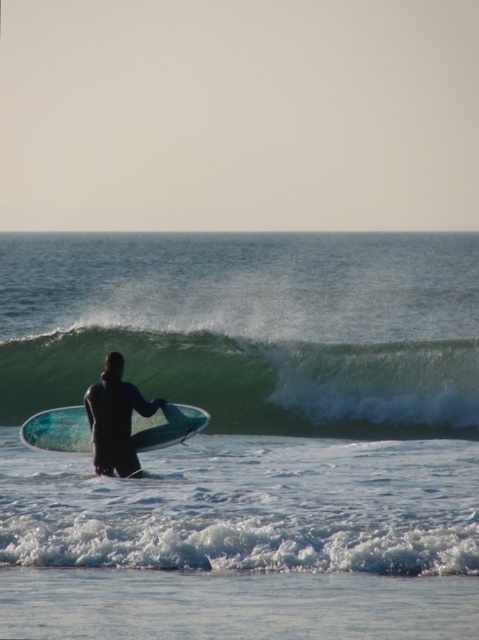
Question: Among these objects, which one is farthest from the camera?

Choices:
 (A) green rubber wave at center
 (B) translucent blue surfboard at center

Answer: (A)

Question: Which point appears farthest from the camera in this image?

Choices:
 (A) (81, 404)
 (B) (369, 410)
 (C) (159, 404)

Answer: (B)

Question: Can you confirm if translucent blue water at center is wider than black wetsuit surfer at center?

Choices:
 (A) no
 (B) yes

Answer: (B)

Question: Among these objects, which one is nearest to the camera?

Choices:
 (A) translucent blue water at center
 (B) green rubber wave at center
 (C) translucent blue surfboard at center
 (D) black wetsuit surfer at center

Answer: (A)

Question: Is translucent blue surfboard at center to the right of black wetsuit surfer at center from the viewer's perspective?

Choices:
 (A) no
 (B) yes

Answer: (B)

Question: Does green rubber wave at center lie behind black wetsuit surfer at center?

Choices:
 (A) no
 (B) yes

Answer: (B)